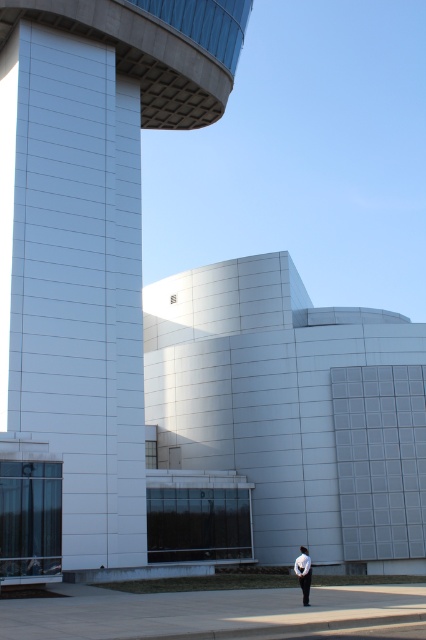
Which is more to the right, white glossy tower at center or white matte shirt at center?

white matte shirt at center is more to the right.

Is white glossy tower at center positioned in front of white matte shirt at center?

A: No, it is behind white matte shirt at center.

Identify the location of white glossy tower at center. The height and width of the screenshot is (640, 426). (86, 253).